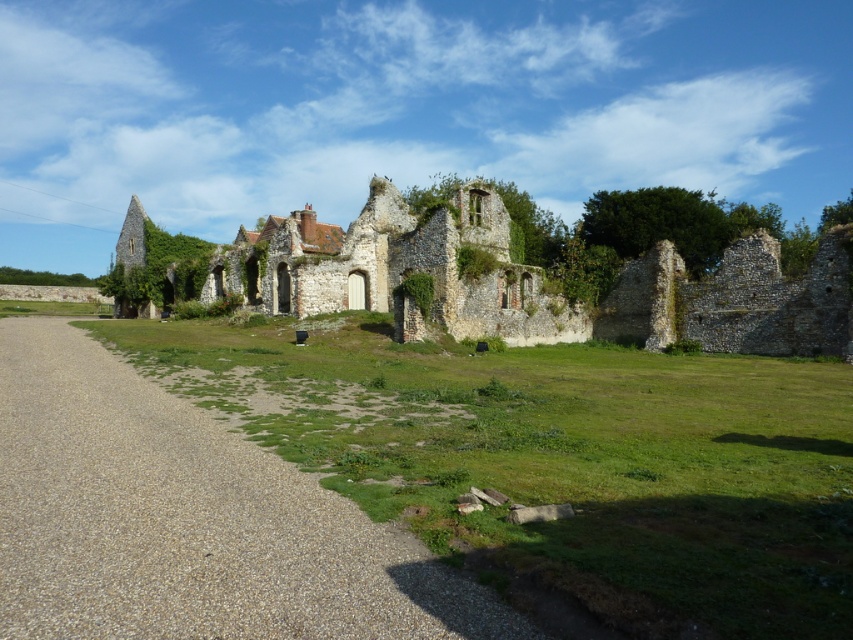
You are standing at the entrance of the historical ruin and want to walk towards the gravelly path at center. According to the coordinates given, where should you head?

You should head towards point (187,520) to reach the gravelly path at center.

You are standing at the point marked by the coordinates point (187, 520). Looking towards the ruins, what surface are you standing on?

You are standing on the gravelly path at center, as the coordinates point (187, 520) corresponds to that location.